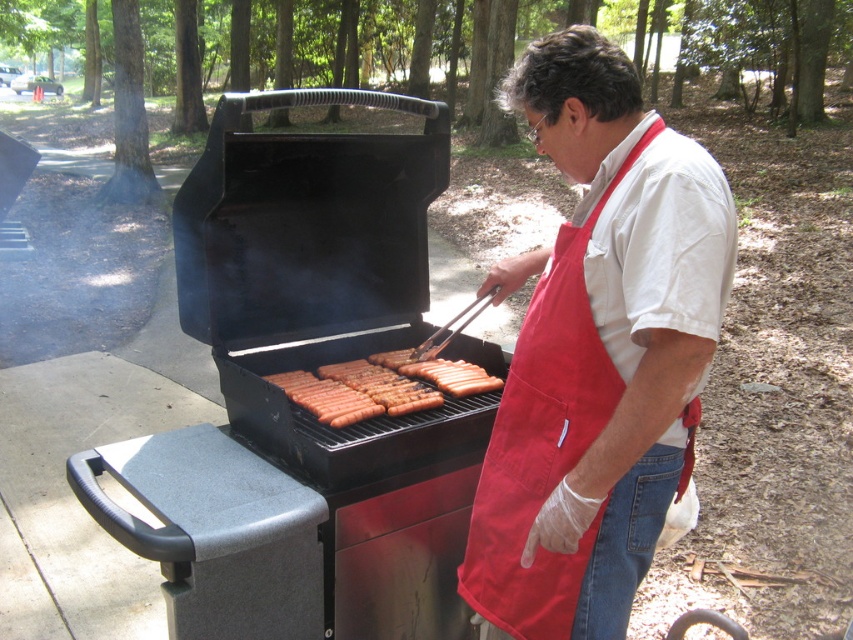
Question: Which object is positioned closest to the white cotton shirt at center?

Choices:
 (A) black matte barbecue grill at center
 (B) brown matte hot dog at center

Answer: (B)

Question: Considering the real-world distances, which object is farthest from the black matte barbecue grill at center?

Choices:
 (A) brown matte hot dog at center
 (B) white cotton shirt at center

Answer: (B)

Question: Observing the image, what is the correct spatial positioning of white cotton shirt at center in reference to brown matte hot dog at center?

Choices:
 (A) above
 (B) below

Answer: (A)

Question: Is black matte barbecue grill at center closer to camera compared to white cotton shirt at center?

Choices:
 (A) yes
 (B) no

Answer: (B)

Question: Does white cotton shirt at center have a smaller size compared to brown matte hot dog at center?

Choices:
 (A) no
 (B) yes

Answer: (A)

Question: Which object appears closest to the camera in this image?

Choices:
 (A) brown matte hot dog at center
 (B) white cotton shirt at center
 (C) black matte barbecue grill at center

Answer: (B)